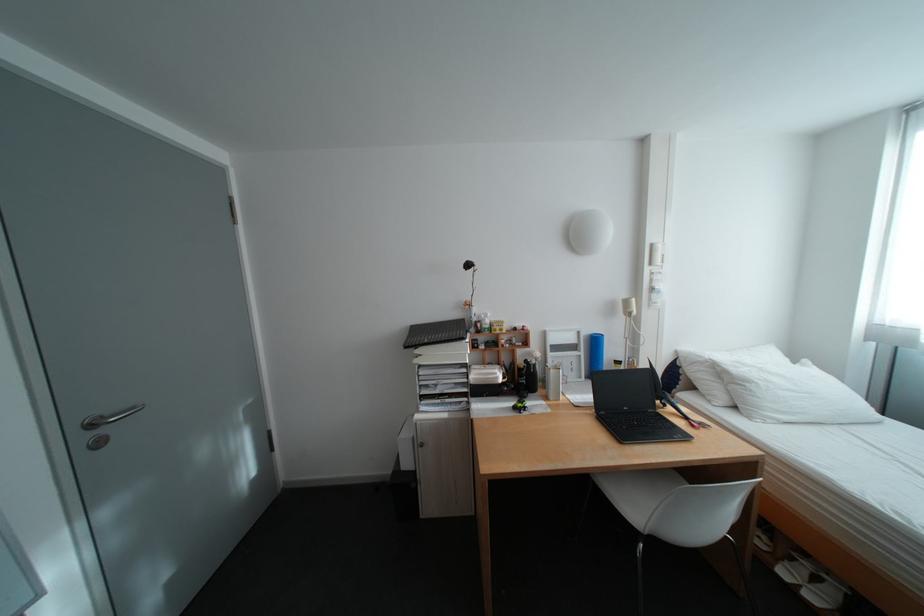
Where is `silver thermos`? silver thermos is located at coordinates (565, 353).